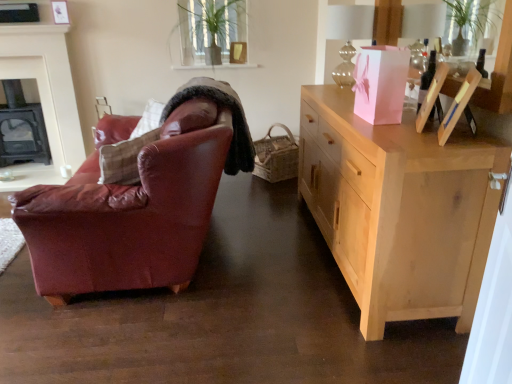
Question: Can you confirm if green leafy plant at upper center is smaller than black cast iron fireplace at left, which is the first fireplace from front to back?

Choices:
 (A) no
 (B) yes

Answer: (A)

Question: Can you confirm if green leafy plant at upper center is taller than black cast iron fireplace at left, which is the first fireplace from front to back?

Choices:
 (A) yes
 (B) no

Answer: (B)

Question: From a real-world perspective, does green leafy plant at upper center stand above black cast iron fireplace at left, the 2th fireplace from the back?

Choices:
 (A) no
 (B) yes

Answer: (B)

Question: Considering the relative sizes of green leafy plant at upper center and black cast iron fireplace at left, the 2th fireplace from the back, in the image provided, is green leafy plant at upper center thinner than black cast iron fireplace at left, the 2th fireplace from the back,?

Choices:
 (A) yes
 (B) no

Answer: (B)

Question: Could you tell me if green leafy plant at upper center is facing black cast iron fireplace at left, which is the first fireplace from front to back?

Choices:
 (A) no
 (B) yes

Answer: (A)

Question: Is point (18, 89) closer or farther from the camera than point (185, 11)?

Choices:
 (A) farther
 (B) closer

Answer: (A)

Question: Considering the positions of black cast iron fireplace at left, the 2th fireplace in the front-to-back sequence, and green leafy plant at upper center in the image, is black cast iron fireplace at left, the 2th fireplace in the front-to-back sequence, taller or shorter than green leafy plant at upper center?

Choices:
 (A) tall
 (B) short

Answer: (A)

Question: Would you say black cast iron fireplace at left, the 2th fireplace in the front-to-back sequence, is inside or outside green leafy plant at upper center?

Choices:
 (A) outside
 (B) inside

Answer: (A)

Question: Based on their positions, is black cast iron fireplace at left, marked as the 1th fireplace in a back-to-front arrangement, located to the left or right of green leafy plant at upper center?

Choices:
 (A) left
 (B) right

Answer: (A)

Question: In terms of size, does green leafy plant at upper center appear bigger or smaller than natural wood cabinet at right?

Choices:
 (A) big
 (B) small

Answer: (B)

Question: Considering the positions of point (180, 16) and point (354, 226), is point (180, 16) closer or farther from the camera than point (354, 226)?

Choices:
 (A) farther
 (B) closer

Answer: (A)

Question: Is green leafy plant at upper center to the left or to the right of natural wood cabinet at right in the image?

Choices:
 (A) left
 (B) right

Answer: (A)

Question: Considering their positions, is green leafy plant at upper center located in front of or behind natural wood cabinet at right?

Choices:
 (A) behind
 (B) front

Answer: (A)

Question: Is green leafy plant at upper center in front of or behind woven brown picnic basket at center in the image?

Choices:
 (A) behind
 (B) front

Answer: (B)

Question: From a real-world perspective, is green leafy plant at upper center positioned above or below woven brown picnic basket at center?

Choices:
 (A) below
 (B) above

Answer: (B)